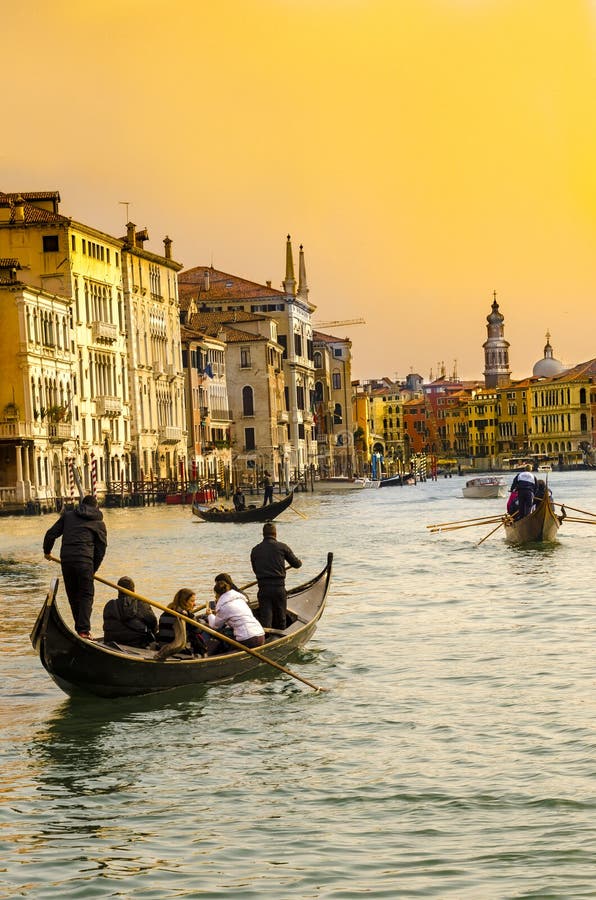
Where is `hood`? The image size is (596, 900). hood is located at coordinates (128, 608), (86, 508).